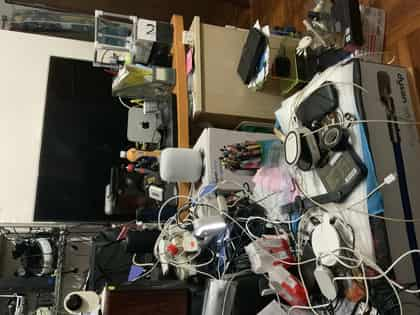
You are a GUI agent. You are given a task and a screenshot of the screen. Output one action in this format:
    pyautogui.click(x=<x>, y=<y>)
    Task: Click on the wall
    The width and height of the screenshot is (420, 315).
    Given the screenshot: What is the action you would take?
    pyautogui.click(x=14, y=129)